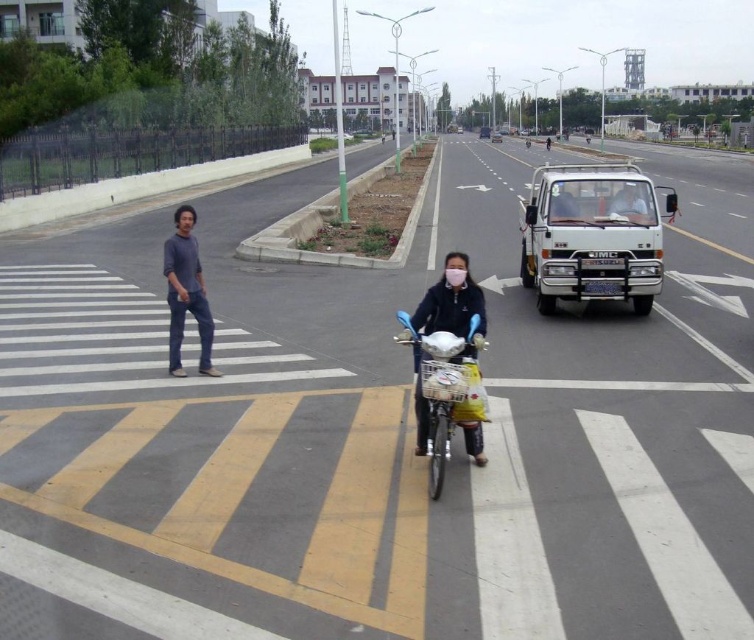
Question: Which object appears farthest from the camera in this image?

Choices:
 (A) gray matte shirt at left
 (B) white matte truck at center-right
 (C) white matte truck at center

Answer: (C)

Question: Is white matte truck at center-right thinner than gray matte shirt at left?

Choices:
 (A) no
 (B) yes

Answer: (A)

Question: From the image, what is the correct spatial relationship of white glossy car at upper center in relation to white matte truck at center?

Choices:
 (A) left
 (B) right

Answer: (A)

Question: Among these objects, which one is nearest to the camera?

Choices:
 (A) metallic blue bicycle at center
 (B) gray matte shirt at left
 (C) white glossy car at upper center

Answer: (A)

Question: Which point appears farthest from the camera in this image?

Choices:
 (A) (633, 214)
 (B) (618, 186)
 (C) (474, 401)

Answer: (B)

Question: Does white glossy car at upper center appear over white matte truck at center?

Choices:
 (A) yes
 (B) no

Answer: (B)